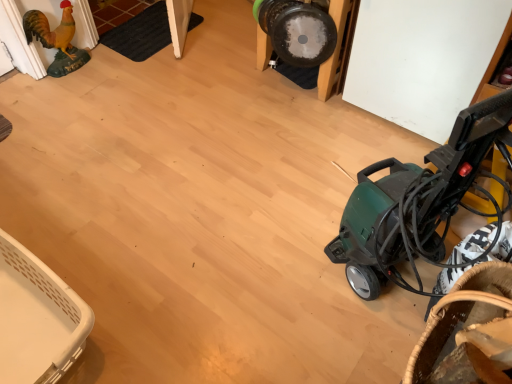
Identify the location of free space between golden matte chicken at left and white plastic basket at lower left, the second basket in the front-to-back sequence. The width and height of the screenshot is (512, 384). click(x=64, y=174).